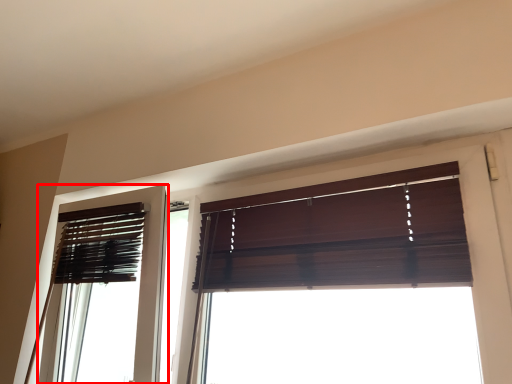
Question: Where is screen door (annotated by the red box) located in relation to window in the image?

Choices:
 (A) right
 (B) left

Answer: (B)